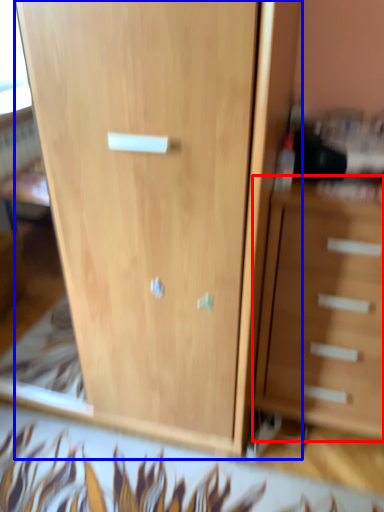
Question: Which of the following is the closest to the observer, chest of drawers (highlighted by a red box) or cupboard (highlighted by a blue box)?

Choices:
 (A) chest of drawers
 (B) cupboard

Answer: (B)